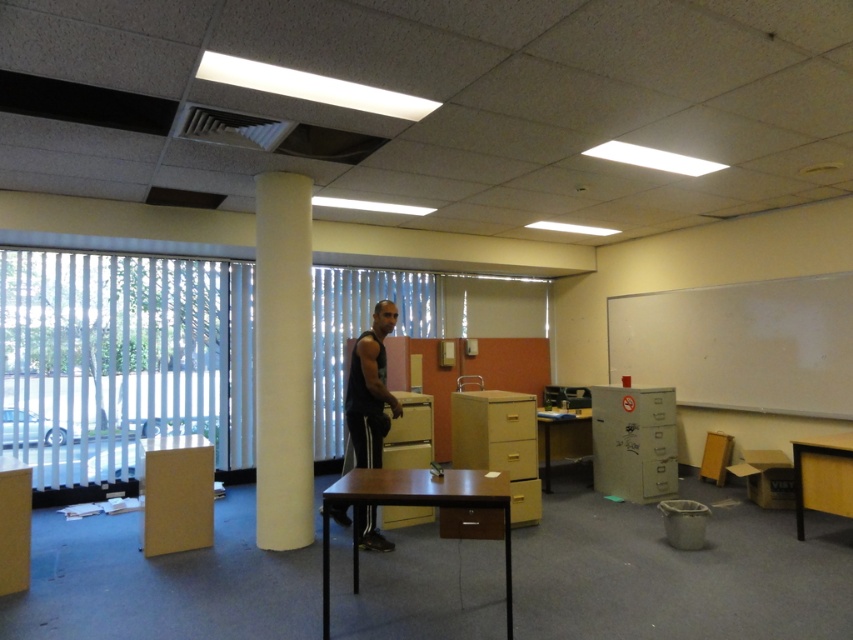
Question: Considering the real-world distances, which object is closest to the yellow matte/file cabinet at center?

Choices:
 (A) brown matte table at center
 (B) wooden desk at center
 (C) matte yellow cabinet at lower left
 (D) metallic gray file cabinet at right

Answer: (A)

Question: Considering the real-world distances, which object is closest to the brown matte table at center?

Choices:
 (A) metallic gray file cabinet at right
 (B) wooden table at lower right

Answer: (B)

Question: Can you confirm if white matte column at center is positioned below brown cardboard file cabinet at center?

Choices:
 (A) yes
 (B) no

Answer: (B)

Question: Is black matte tank top at center positioned at the back of wooden table at lower right?

Choices:
 (A) no
 (B) yes

Answer: (B)

Question: Can you confirm if metallic gray file cabinet at right is positioned to the right of wooden table at lower right?

Choices:
 (A) yes
 (B) no

Answer: (B)

Question: Estimate the real-world distances between objects in this image. Which object is farther from the black matte tank top at center?

Choices:
 (A) wooden table at lower right
 (B) matte yellow cabinet at lower left
 (C) brown cardboard file cabinet at center

Answer: (A)